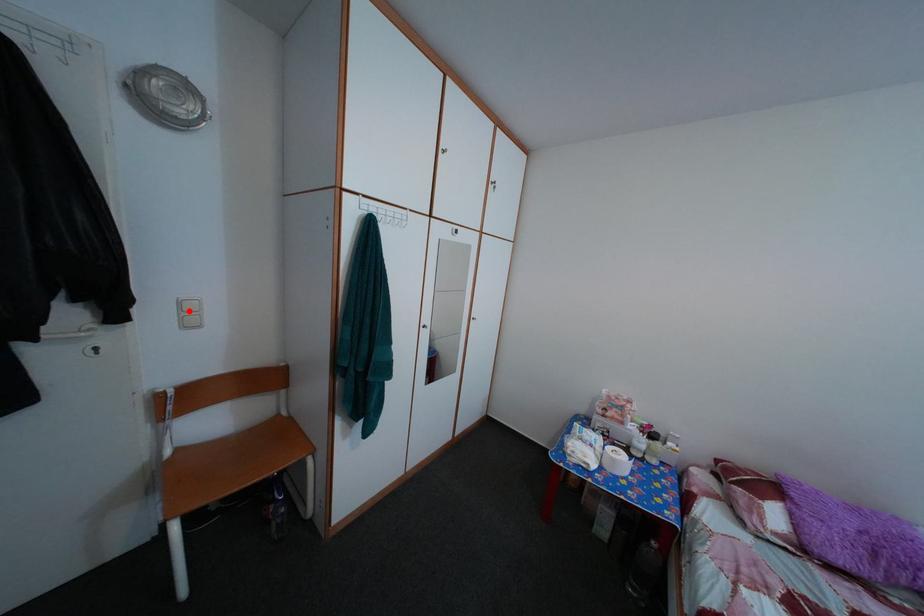
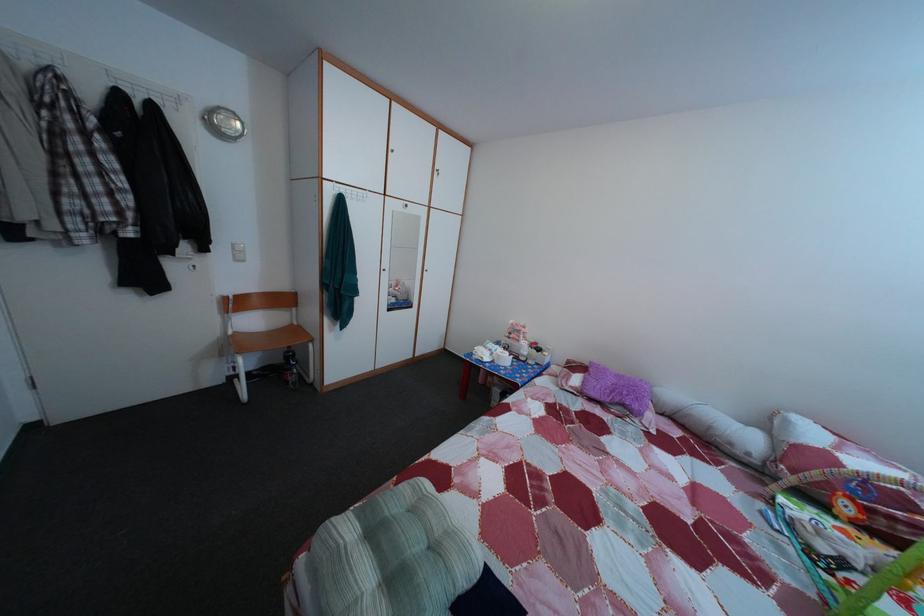
Locate, in the second image, the point that corresponds to the highlighted location in the first image.

(242, 254)